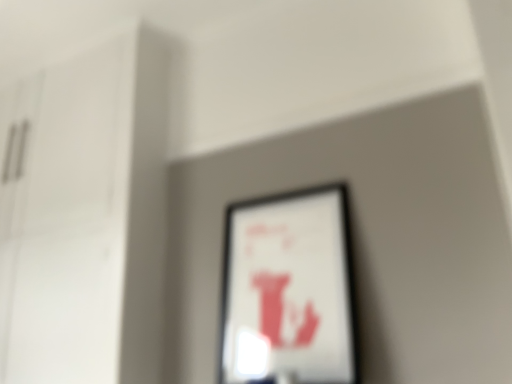
The width and height of the screenshot is (512, 384). What do you see at coordinates (288, 290) in the screenshot?
I see `matte black picture frame at center` at bounding box center [288, 290].

Locate an element on the screen. matte black picture frame at center is located at coordinates (288, 290).

Image resolution: width=512 pixels, height=384 pixels. Identify the location of matte black picture frame at center. (288, 290).